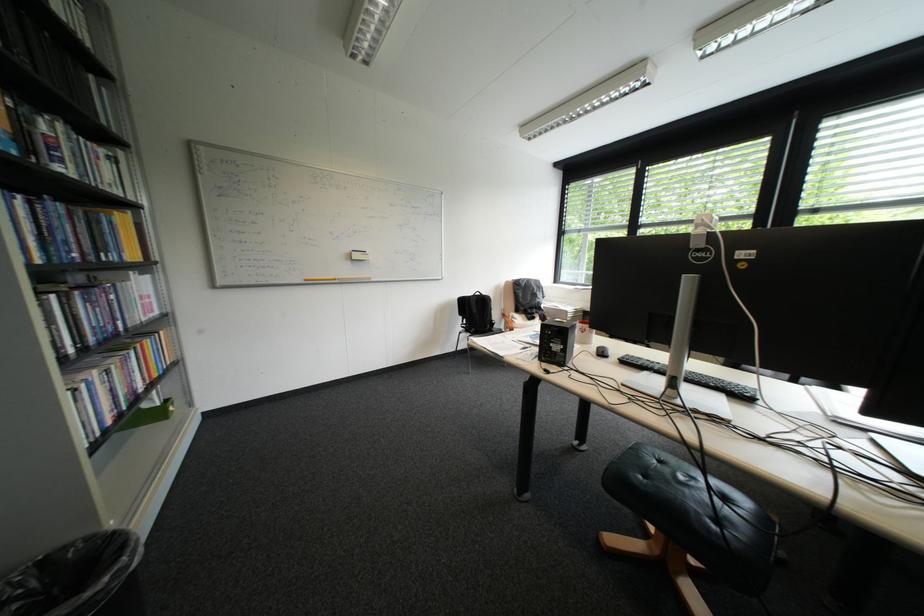
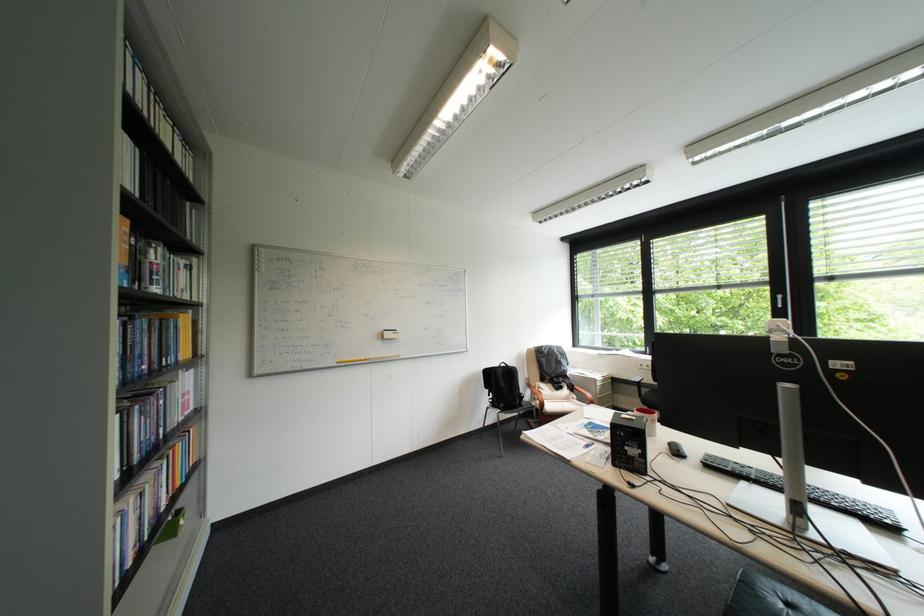
Locate, in the second image, the point that corresponds to point 318,278 in the first image.

(350, 361)